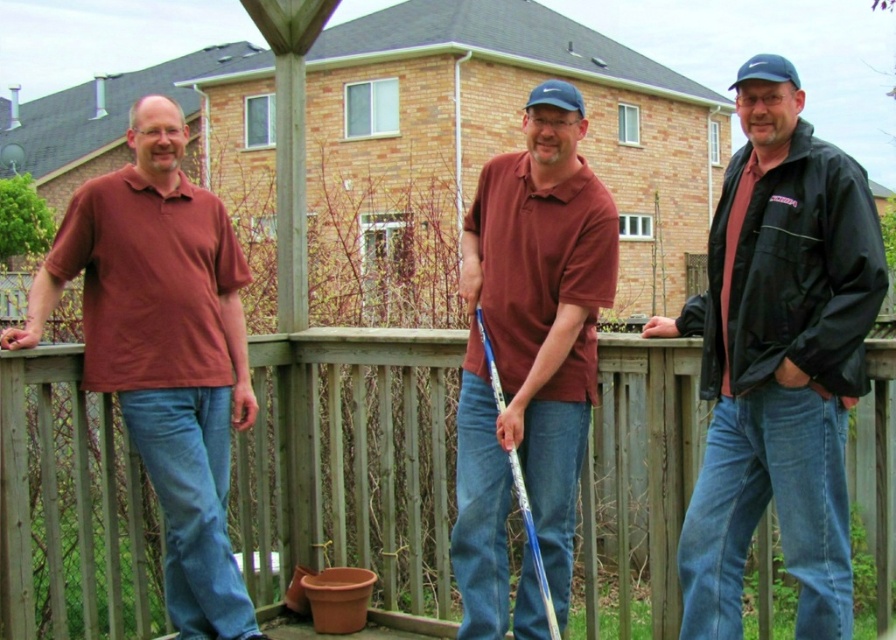
You are organizing a photo shoot and need to arrange the black matte jacket at center and the matte red shirt at left based on their sizes. Which item should you place first if you want to start with the smaller one?

The black matte jacket at center occupies less space than the matte red shirt at left, so you should place the black matte jacket at center first since it is smaller.

Based on the photo, you are a photographer trying to capture a clear shot of the black matte jacket at center and the wooden railing at center. Based on their positions, which object is closer to the camera?

The wooden railing at center is closer to the camera because the black matte jacket at center is behind it.

You are standing on the wooden deck and want to walk towards the brick building. Which point, point (418, 440) or point (476, 534), would you reach first?

Point (418, 440) is further to the camera than point (476, 534), so you would reach point (476, 534) first.